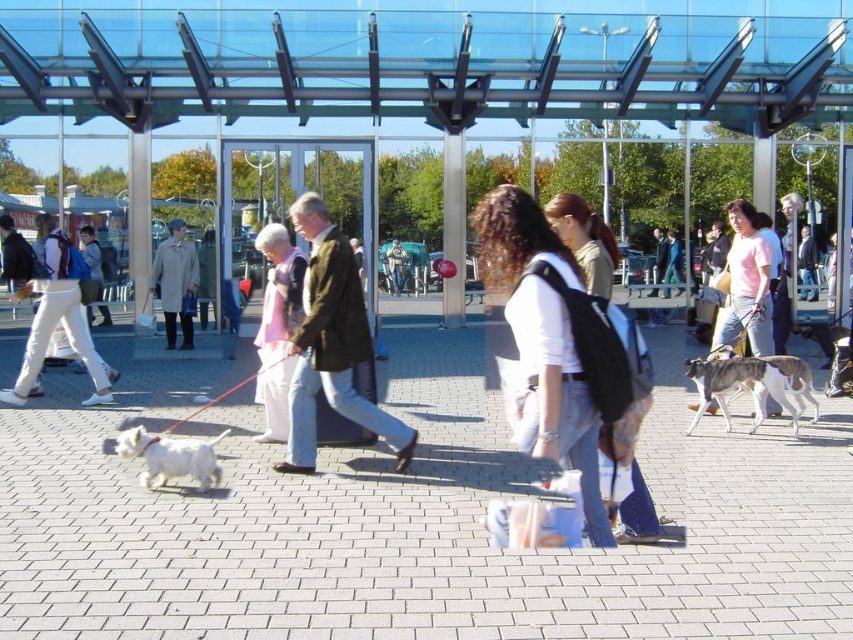
Question: Based on their relative distances, which object is farther from the white fluffy dog at lower left?

Choices:
 (A) white fur dog at right
 (B) green textured jacket at center

Answer: (A)

Question: Which point appears closest to the camera in this image?

Choices:
 (A) (309, 429)
 (B) (746, 216)

Answer: (A)

Question: Is white fluffy dog at lower left wider than light beige coat at center?

Choices:
 (A) no
 (B) yes

Answer: (A)

Question: Which object is farther from the camera taking this photo?

Choices:
 (A) green textured jacket at center
 (B) pink cotton t-shirt at center

Answer: (B)

Question: Is white matte backpack at center thinner than white fur dog at right?

Choices:
 (A) yes
 (B) no

Answer: (A)

Question: Is white fur dog at right above white fluffy dog at lower left?

Choices:
 (A) yes
 (B) no

Answer: (A)